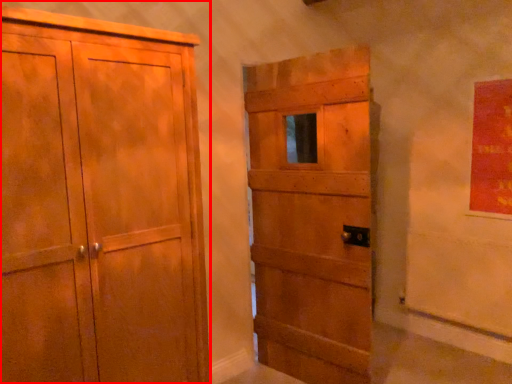
Question: From the image's perspective, where is cupboard (annotated by the red box) located relative to door?

Choices:
 (A) above
 (B) below

Answer: (B)